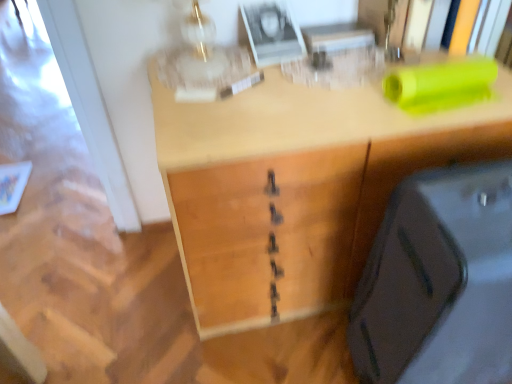
The image size is (512, 384). In order to click on wooden desk at center in this screenshot , I will do `click(297, 187)`.

Image resolution: width=512 pixels, height=384 pixels. Describe the element at coordinates (297, 187) in the screenshot. I see `wooden desk at center` at that location.

Describe the element at coordinates (439, 282) in the screenshot. I see `matte black suitcase at lower right` at that location.

Where is `matte black suitcase at lower right`? This screenshot has height=384, width=512. matte black suitcase at lower right is located at coordinates (439, 282).

Find the location of a particular element. wooden desk at center is located at coordinates (297, 187).

Considering the relative positions of wooden desk at center and matte black suitcase at lower right in the image provided, is wooden desk at center to the right of matte black suitcase at lower right from the viewer's perspective?

No, wooden desk at center is not to the right of matte black suitcase at lower right.

Is the depth of wooden desk at center greater than that of matte black suitcase at lower right?

Yes, wooden desk at center is behind matte black suitcase at lower right.

Considering the positions of points (232, 261) and (437, 177), is point (232, 261) farther from camera compared to point (437, 177)?

Yes, point (232, 261) is behind point (437, 177).

From the image's perspective, relative to matte black suitcase at lower right, is wooden desk at center above or below?

wooden desk at center is situated higher than matte black suitcase at lower right in the image.

From a real-world perspective, is wooden desk at center under matte black suitcase at lower right?

Indeed, from a real-world perspective, wooden desk at center is positioned beneath matte black suitcase at lower right.

Can you confirm if wooden desk at center is thinner than matte black suitcase at lower right?

No, wooden desk at center is not thinner than matte black suitcase at lower right.

Between wooden desk at center and matte black suitcase at lower right, which one has more height?

matte black suitcase at lower right is taller.

Looking at the image, does wooden desk at center seem bigger or smaller compared to matte black suitcase at lower right?

In the image, wooden desk at center appears to be larger than matte black suitcase at lower right.

Is matte black suitcase at lower right a part of wooden desk at center?

No.

Is the surface of wooden desk at center in direct contact with matte black suitcase at lower right?

wooden desk at center and matte black suitcase at lower right are not in contact.

Is wooden desk at center positioned with its back to matte black suitcase at lower right?

That's not correct — wooden desk at center is not looking away from matte black suitcase at lower right.

How many degrees apart are the facing directions of wooden desk at center and matte black suitcase at lower right?

The angle between the facing direction of wooden desk at center and the facing direction of matte black suitcase at lower right is 2.71 degrees.

I want to click on desk located above the matte black suitcase at lower right (from the image's perspective), so click(x=297, y=187).

Which is more to the left, matte black suitcase at lower right or wooden desk at center?

wooden desk at center is more to the left.

Relative to wooden desk at center, is matte black suitcase at lower right in front or behind?

matte black suitcase at lower right is in front of wooden desk at center.

Which is less distant, (385, 215) or (500, 68)?

Point (385, 215).

From the image's perspective, between matte black suitcase at lower right and wooden desk at center, which one is located above?

wooden desk at center.

From a real-world perspective, between matte black suitcase at lower right and wooden desk at center, who is vertically lower?

wooden desk at center is physically lower.

Is matte black suitcase at lower right wider or thinner than wooden desk at center?

Considering their sizes, matte black suitcase at lower right looks slimmer than wooden desk at center.

Considering the sizes of objects matte black suitcase at lower right and wooden desk at center in the image provided, who is taller, matte black suitcase at lower right or wooden desk at center?

matte black suitcase at lower right.

In terms of size, does matte black suitcase at lower right appear bigger or smaller than wooden desk at center?

matte black suitcase at lower right is smaller than wooden desk at center.

Is matte black suitcase at lower right surrounding wooden desk at center?

No, wooden desk at center is located outside of matte black suitcase at lower right.

Is matte black suitcase at lower right not near wooden desk at center?

That's not correct — matte black suitcase at lower right is a little close to wooden desk at center.

Is matte black suitcase at lower right aimed at wooden desk at center?

No, matte black suitcase at lower right is not turned towards wooden desk at center.

Can you tell me how much matte black suitcase at lower right and wooden desk at center differ in facing direction?

The angle between the facing direction of matte black suitcase at lower right and the facing direction of wooden desk at center is 2.71 degrees.

Measure the distance from matte black suitcase at lower right to wooden desk at center.

They are 25.59 centimeters apart.

At what (x,y) coordinates should I click in order to perform the action: click on desk behind the matte black suitcase at lower right. Please return your answer as a coordinate pair (x, y). Looking at the image, I should click on (297, 187).

Where is `luggage on the right of wooden desk at center`? The height and width of the screenshot is (384, 512). luggage on the right of wooden desk at center is located at coordinates (439, 282).

Identify the location of luggage below the wooden desk at center (from the image's perspective). Image resolution: width=512 pixels, height=384 pixels. (439, 282).